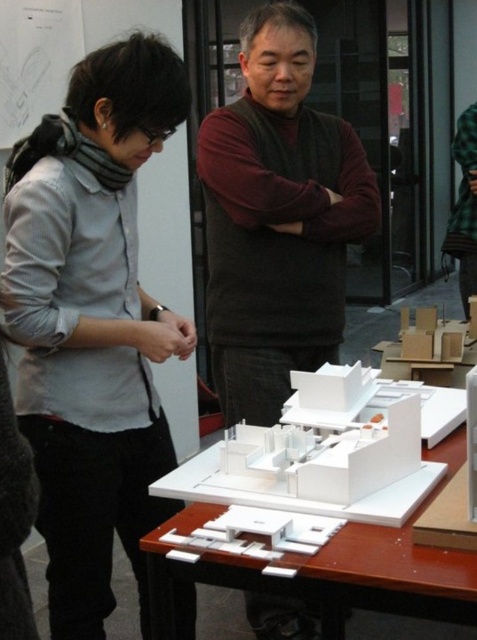
You are an architect standing to the left of the white matte table at center. You want to hand a document to the person wearing the green plaid shirt at center. Can you reach them without moving around the table?

The white matte table at center is positioned on the left side of green plaid shirt at center. Since you are already to the left of the table, you can reach the person wearing the green plaid shirt at center by extending your arm across the table.

You are a delivery person carrying a package that requires a 2.5 meter clearance to pass through a narrow hallway. You see the matte gray shirt at left and the green plaid shirt at center in the scene. Can you safely navigate between them with your package?

The distance between the matte gray shirt at left and the green plaid shirt at center is 2.33 meters, which is less than the required 2.5 meters clearance. Therefore, you cannot safely navigate between them with the package.

You are standing in a design studio and want to examine the architectural models on the table. Considering the distance between you and the matte gray shirt at left, can you comfortably reach the models without moving closer?

The distance between you and the matte gray shirt at left is 4.34 feet. Since the models are on the table, you can likely reach them comfortably from that distance without needing to move closer.